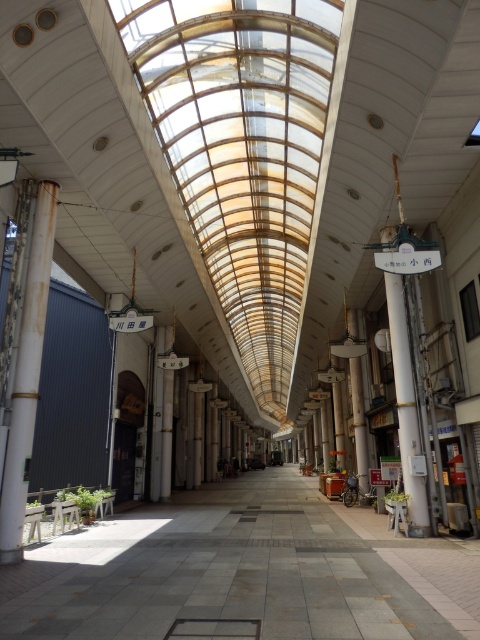
Question: Is gray concrete corridor at center wider than rusty metal pole at left?

Choices:
 (A) no
 (B) yes

Answer: (B)

Question: Is gray concrete corridor at center closer to camera compared to rusty metal pole at left?

Choices:
 (A) no
 (B) yes

Answer: (B)

Question: Which point is closer to the camera?

Choices:
 (A) gray concrete corridor at center
 (B) rusty metal pole at left

Answer: (A)

Question: Does gray concrete corridor at center have a lesser width compared to rusty metal pole at left?

Choices:
 (A) yes
 (B) no

Answer: (B)

Question: Which point is farther from the camera taking this photo?

Choices:
 (A) (475, 604)
 (B) (32, 330)

Answer: (B)